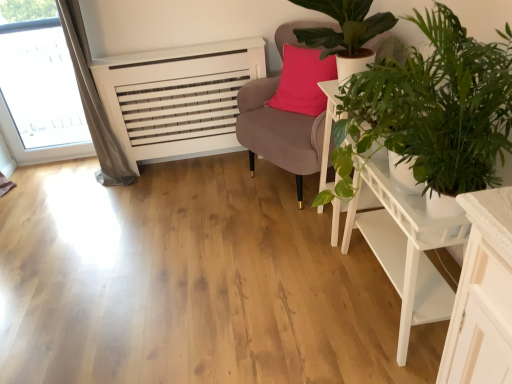
You are a GUI agent. You are given a task and a screenshot of the screen. Output one action in this format:
    pyautogui.click(x=<x>, y=<y>)
    Task: Click on the vacant space situated on the left part of velvet pink chair at upper right
    This screenshot has height=384, width=512.
    Given the screenshot: What is the action you would take?
    pos(199,198)